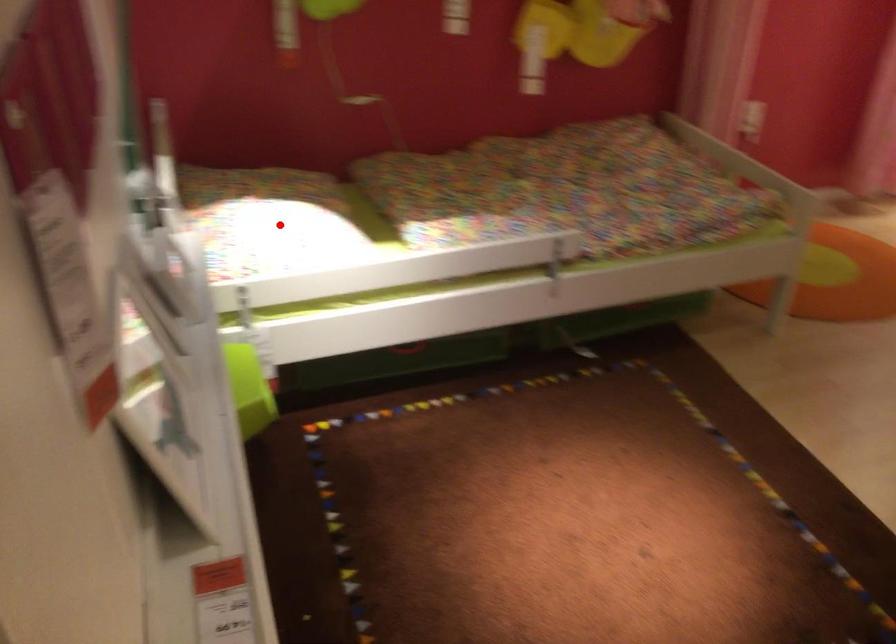
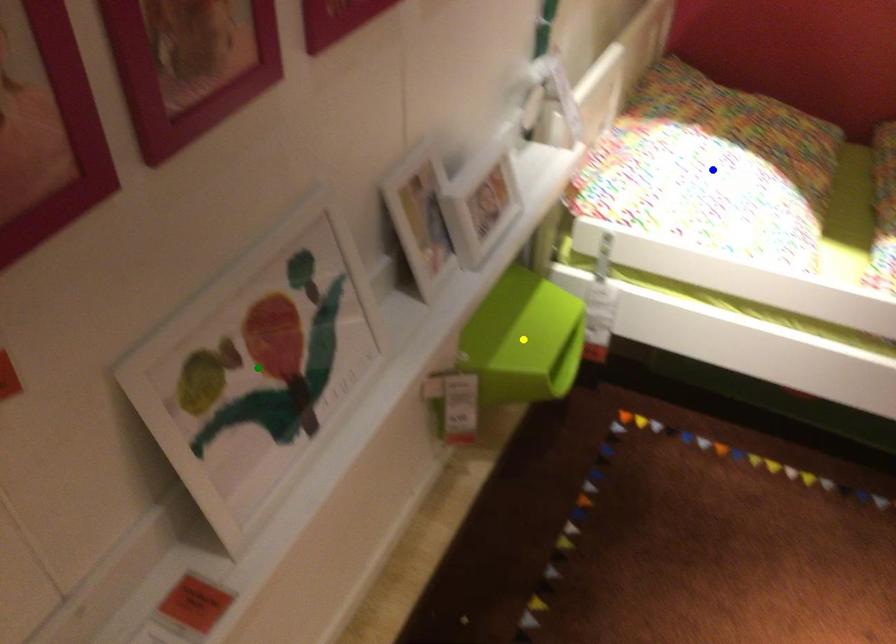
Question: I am providing you with two images of the same scene from different viewpoints. A red point is marked on the first image. You are given multiple points on the second image. Which mark in image 2 goes with the point in image 1?

Choices:
 (A) green point
 (B) yellow point
 (C) blue point

Answer: (C)